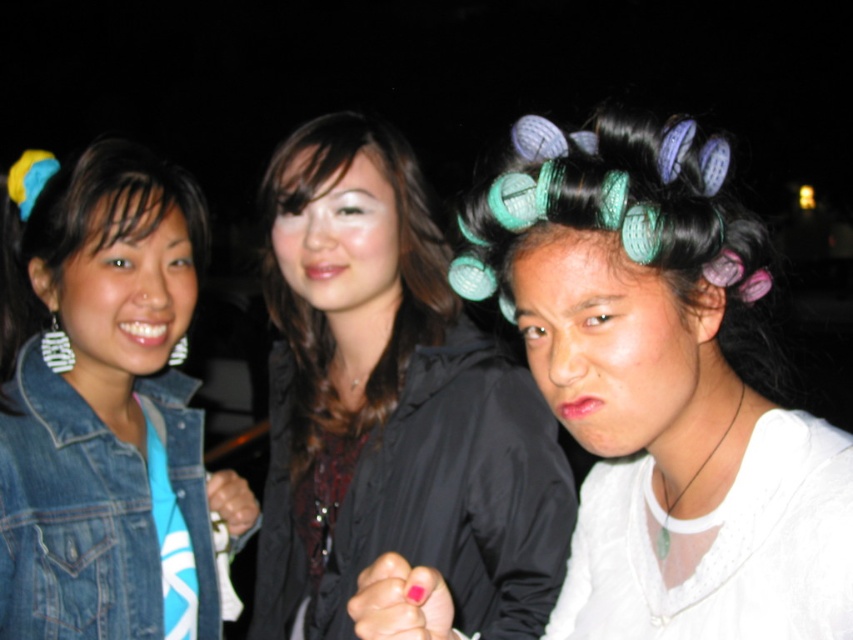
Question: Which point appears farthest from the camera in this image?

Choices:
 (A) (62, 177)
 (B) (306, 182)
 (C) (300, 433)
 (D) (99, 584)

Answer: (C)

Question: Does shiny black hair at center have a greater width compared to brownsmoothhair at center?

Choices:
 (A) yes
 (B) no

Answer: (A)

Question: Can you confirm if denim jacket at lower left is positioned to the right of black matte hair at left?

Choices:
 (A) no
 (B) yes

Answer: (B)

Question: Considering the real-world distances, which object is closest to the brownsmoothhair at center?

Choices:
 (A) teal plastic curlers at center
 (B) black matte hair at left
 (C) shiny black hair at center

Answer: (C)

Question: Is shiny black hair at center positioned behind brownsmoothhair at center?

Choices:
 (A) yes
 (B) no

Answer: (B)

Question: Which point is closer to the camera?

Choices:
 (A) (492, 566)
 (B) (773, 476)
 (C) (659, 186)
 (D) (115, 492)

Answer: (C)